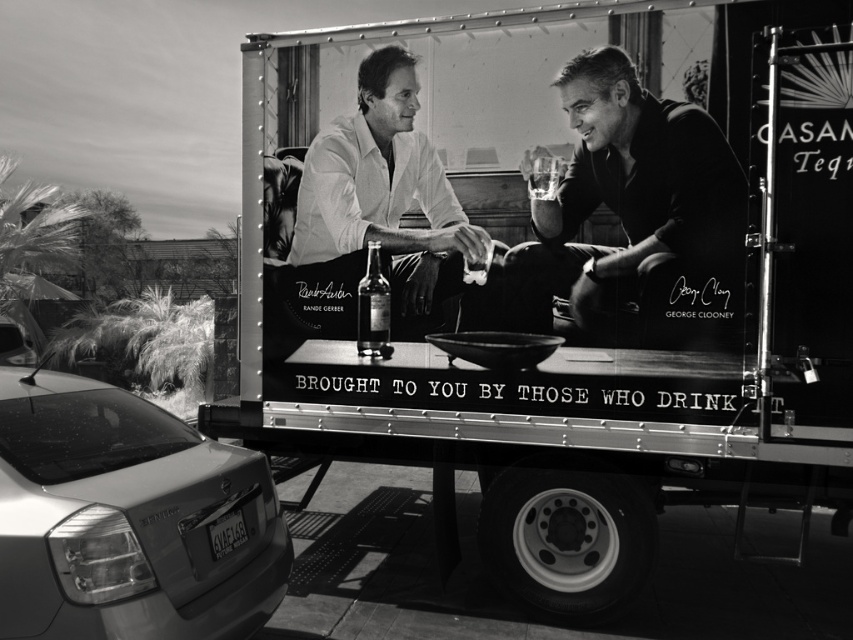
You are standing in front of the truck with the advertisement for Rande Gerber and George Clooney. There is a point marked at coordinates (x=561, y=273) on the truck. What object is located at this point?

The point at coordinates (x=561, y=273) marks the metallic trailer truck at center.

You are a photographer setting up a shoot in the scene described. You need to position a light to the left of the metallic trailer truck at center. Will this light be to the right or left of the satin silver sedan at lower left?

The metallic trailer truck at center is to the right of the satin silver sedan at lower left. Placing the light to the left of the metallic trailer truck at center would position it between the two vehicles, so the light will be to the left of the metallic trailer truck at center but to the right of the satin silver sedan at lower left.

You are a photographer adjusting your camera to focus on two points in the image. The first point is at coordinates point (828,220) and the second is at point (448,182). Which point should you focus on first if you want to capture the closest object to the camera?

Point (828,220) is closer to the camera than point (448,182), so you should focus on point (828,220) first to capture the closest object.